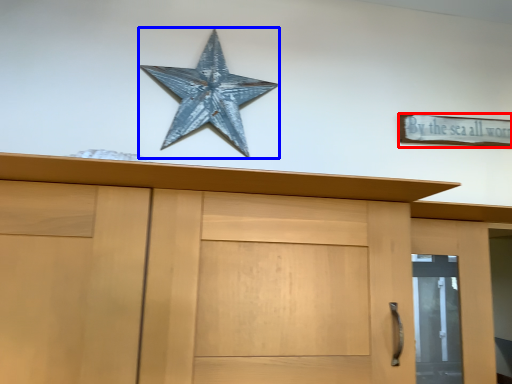
Question: Which point is closer to the camera, magnet (highlighted by a red box) or starfish (highlighted by a blue box)?

Choices:
 (A) magnet
 (B) starfish

Answer: (B)